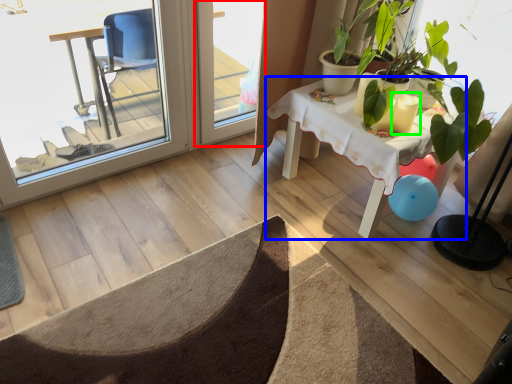
Question: Which object is the closest to the screen door (highlighted by a red box)? Choose among these: table (highlighted by a blue box) or candle holder (highlighted by a green box).

Choices:
 (A) table
 (B) candle holder

Answer: (A)